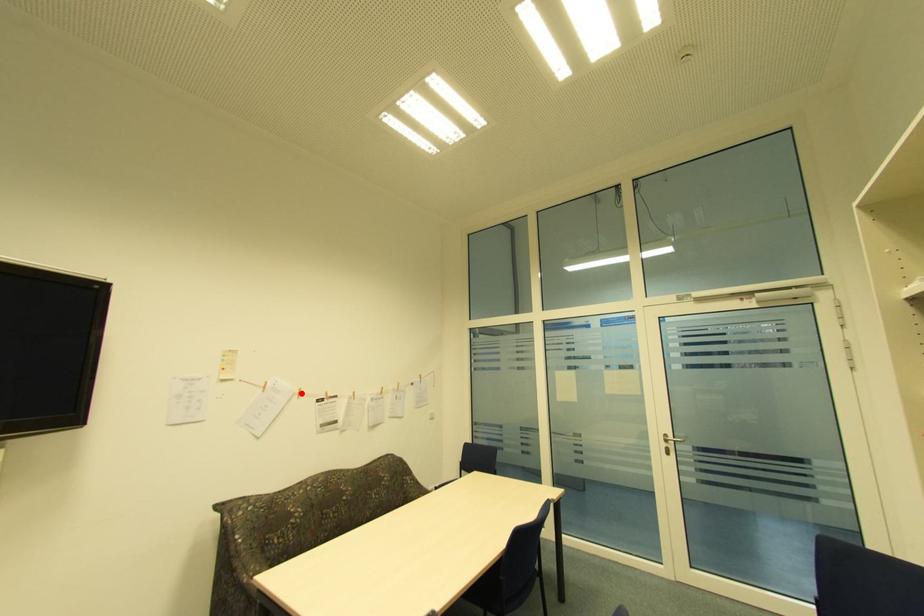
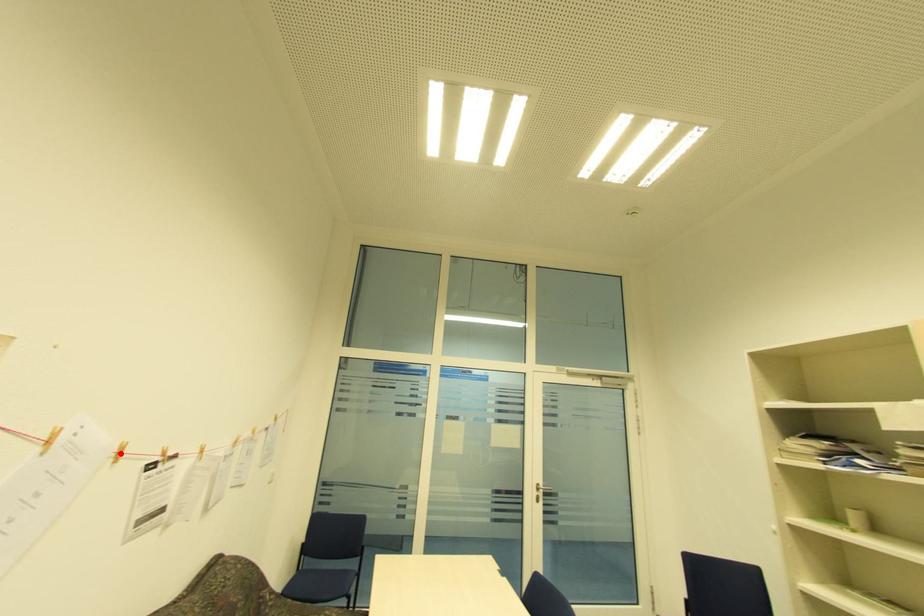
From the picture: I am providing you with two images of the same scene from different viewpoints. A red point is marked on the first image and another point is marked on the second image. Is the marked point in image1 the same physical position as the marked point in image2?

Yes